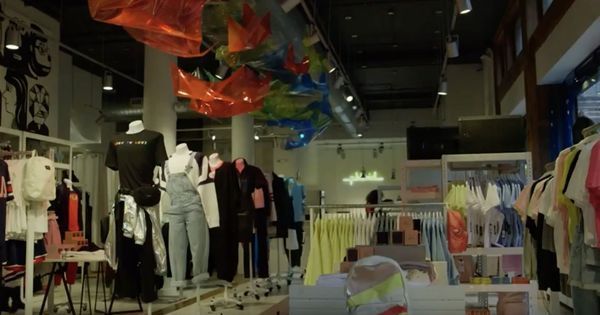
Identify the location of neon light. This screenshot has width=600, height=315. (374, 178).